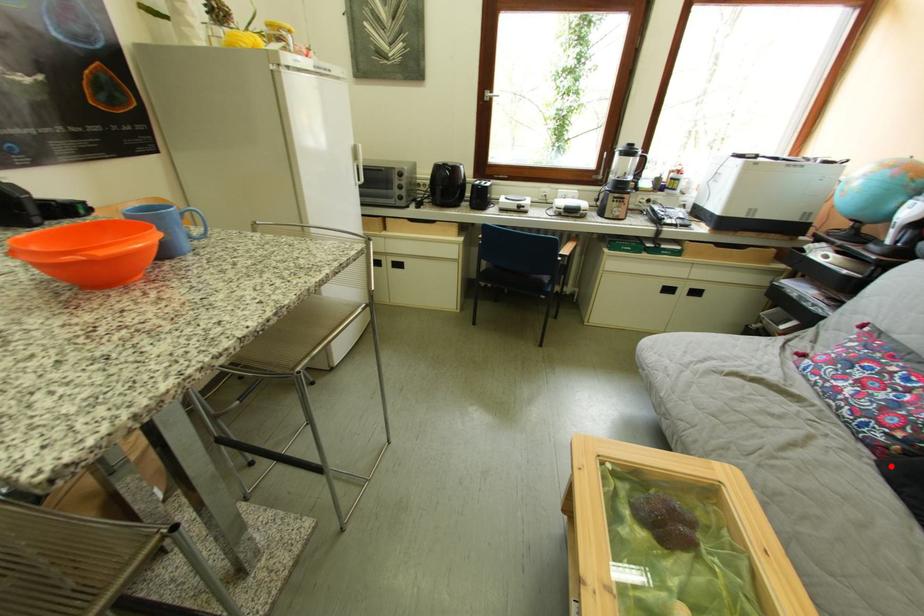
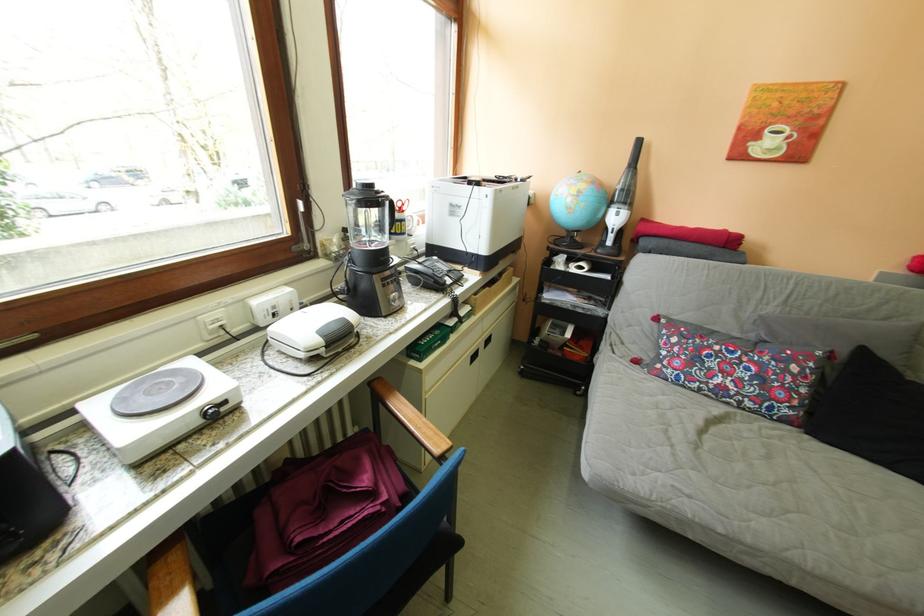
Question: I am providing you with two images of the same scene from different viewpoints. In image1, a red point is highlighted. Considering the same 3D point in image2, which of the following is correct?

Choices:
 (A) It is closer
 (B) It is farther

Answer: (A)